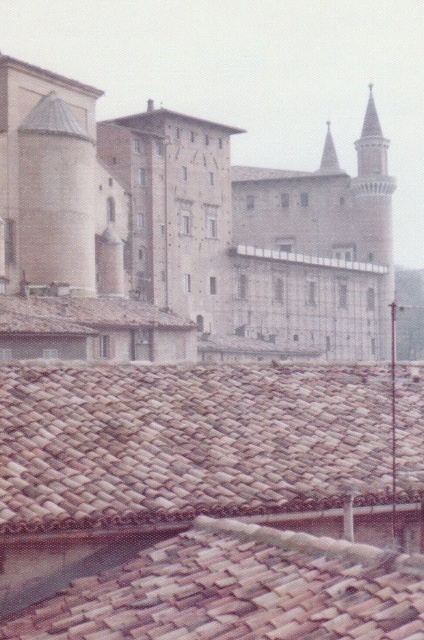
Question: Is the position of brown clay tiles at center more distant than that of brown tile roof at center?

Choices:
 (A) yes
 (B) no

Answer: (B)

Question: From the image, what is the correct spatial relationship of brown clay tiles at lower center in relation to brown clay tiles at center?

Choices:
 (A) right
 (B) left

Answer: (A)

Question: Considering the real-world distances, which object is farthest from the brown tile roof at center?

Choices:
 (A) brown clay tiles at center
 (B) brown clay tiles at lower center

Answer: (A)

Question: From the image, what is the correct spatial relationship of brown clay tiles at lower center in relation to brown clay tiles at center?

Choices:
 (A) above
 (B) below

Answer: (A)

Question: Estimate the real-world distances between objects in this image. Which object is farther from the brown clay tiles at lower center?

Choices:
 (A) brown tile roof at center
 (B) brown clay tiles at center

Answer: (A)

Question: Which point is farther to the camera?

Choices:
 (A) (33, 310)
 (B) (351, 390)
 (C) (323, 568)

Answer: (A)